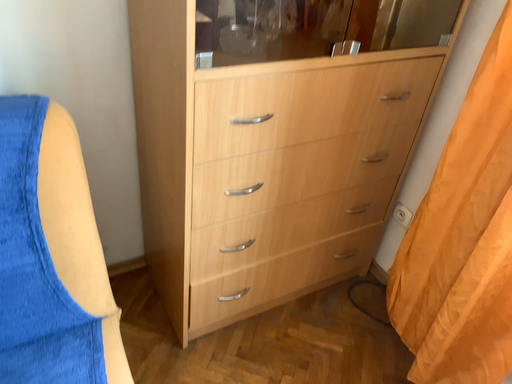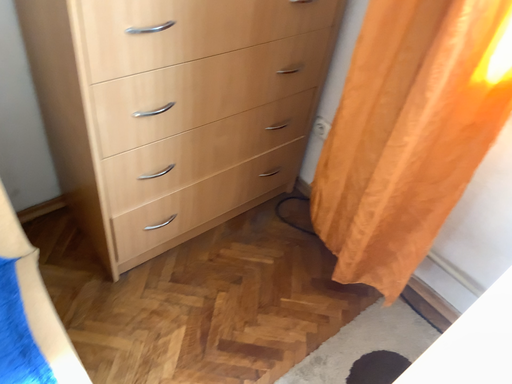
Question: Which way did the camera rotate in the video?

Choices:
 (A) rotated right
 (B) rotated left

Answer: (A)